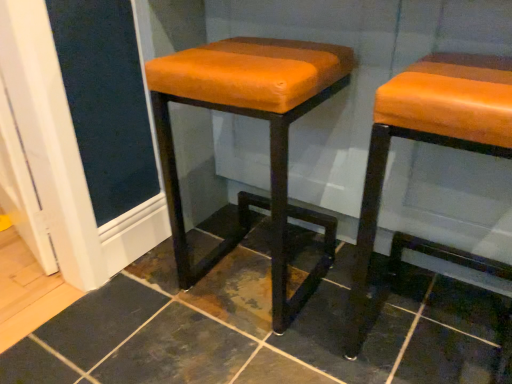
Measure the distance between orange leather stool at center, which appears as the 2th stool when viewed from the right, and camera.

A distance of 30.98 inches exists between orange leather stool at center, which appears as the 2th stool when viewed from the right, and camera.

The width and height of the screenshot is (512, 384). What do you see at coordinates (270, 138) in the screenshot?
I see `orange leather stool at center, which ranks as the first stool in left-to-right order` at bounding box center [270, 138].

Image resolution: width=512 pixels, height=384 pixels. I want to click on orange leather stool at center, which ranks as the first stool in left-to-right order, so click(x=270, y=138).

This screenshot has height=384, width=512. Identify the location of orange leather stool at right, the second stool viewed from the left. (429, 143).

This screenshot has width=512, height=384. Describe the element at coordinates (429, 143) in the screenshot. I see `orange leather stool at right, the second stool viewed from the left` at that location.

Measure the distance between orange leather stool at right, which is the first stool from right to left, and camera.

They are 24.47 inches apart.

At what (x,y) coordinates should I click in order to perform the action: click on orange leather stool at center, which appears as the 2th stool when viewed from the right. Please return your answer as a coordinate pair (x, y). This screenshot has height=384, width=512. Looking at the image, I should click on tap(270, 138).

In the image, is orange leather stool at right, the second stool viewed from the left, on the left side or the right side of orange leather stool at center, which appears as the 2th stool when viewed from the right?

From the image, it's evident that orange leather stool at right, the second stool viewed from the left, is to the right of orange leather stool at center, which appears as the 2th stool when viewed from the right.

In the image, is orange leather stool at right, which is the first stool from right to left, positioned in front of or behind orange leather stool at center, which ranks as the first stool in left-to-right order?

orange leather stool at right, which is the first stool from right to left, is positioned closer to the viewer than orange leather stool at center, which ranks as the first stool in left-to-right order.

Is point (398, 92) positioned after point (289, 40)?

No, it is not.

From the image's perspective, does orange leather stool at right, which is the first stool from right to left, appear lower than orange leather stool at center, which appears as the 2th stool when viewed from the right?

Yes, from the image's perspective, orange leather stool at right, which is the first stool from right to left, is beneath orange leather stool at center, which appears as the 2th stool when viewed from the right.

From a real-world perspective, which object rests below the other?

orange leather stool at center, which appears as the 2th stool when viewed from the right, from a real-world perspective.

In terms of width, does orange leather stool at right, which is the first stool from right to left, look wider or thinner when compared to orange leather stool at center, which ranks as the first stool in left-to-right order?

Considering their sizes, orange leather stool at right, which is the first stool from right to left, looks broader than orange leather stool at center, which ranks as the first stool in left-to-right order.

Which of these two, orange leather stool at right, which is the first stool from right to left, or orange leather stool at center, which ranks as the first stool in left-to-right order, stands taller?

orange leather stool at center, which ranks as the first stool in left-to-right order.

Who is smaller, orange leather stool at right, the second stool viewed from the left, or orange leather stool at center, which appears as the 2th stool when viewed from the right?

Smaller between the two is orange leather stool at right, the second stool viewed from the left.

Would you say orange leather stool at center, which appears as the 2th stool when viewed from the right, is part of orange leather stool at right, which is the first stool from right to left,'s contents?

No, orange leather stool at center, which appears as the 2th stool when viewed from the right, is located outside of orange leather stool at right, which is the first stool from right to left.

Can you see orange leather stool at right, the second stool viewed from the left, touching orange leather stool at center, which ranks as the first stool in left-to-right order?

orange leather stool at right, the second stool viewed from the left, is not next to orange leather stool at center, which ranks as the first stool in left-to-right order, and they're not touching.

Could you tell me if orange leather stool at right, which is the first stool from right to left, is facing orange leather stool at center, which appears as the 2th stool when viewed from the right?

No, orange leather stool at right, which is the first stool from right to left, does not turn towards orange leather stool at center, which appears as the 2th stool when viewed from the right.

How far apart are orange leather stool at right, which is the first stool from right to left, and orange leather stool at center, which appears as the 2th stool when viewed from the right?

They are 11.51 inches apart.

What are the coordinates of `stool located on the right of orange leather stool at center, which appears as the 2th stool when viewed from the right` in the screenshot? It's located at (429, 143).

Between orange leather stool at center, which appears as the 2th stool when viewed from the right, and orange leather stool at right, which is the first stool from right to left, which one appears on the left side from the viewer's perspective?

Positioned to the left is orange leather stool at center, which appears as the 2th stool when viewed from the right.

Relative to orange leather stool at right, which is the first stool from right to left, is orange leather stool at center, which appears as the 2th stool when viewed from the right, in front or behind?

Visually, orange leather stool at center, which appears as the 2th stool when viewed from the right, is located behind orange leather stool at right, which is the first stool from right to left.

Which is in front, point (172, 140) or point (350, 325)?

Point (350, 325)

From the image's perspective, is orange leather stool at center, which appears as the 2th stool when viewed from the right, below orange leather stool at right, which is the first stool from right to left?

No.

From a real-world perspective, is orange leather stool at center, which ranks as the first stool in left-to-right order, under orange leather stool at right, the second stool viewed from the left?

Correct, in the physical world, orange leather stool at center, which ranks as the first stool in left-to-right order, is lower than orange leather stool at right, the second stool viewed from the left.

In terms of width, does orange leather stool at center, which ranks as the first stool in left-to-right order, look wider or thinner when compared to orange leather stool at right, the second stool viewed from the left?

Considering their sizes, orange leather stool at center, which ranks as the first stool in left-to-right order, looks slimmer than orange leather stool at right, the second stool viewed from the left.

Which of these two, orange leather stool at center, which appears as the 2th stool when viewed from the right, or orange leather stool at right, which is the first stool from right to left, stands taller?

With more height is orange leather stool at center, which appears as the 2th stool when viewed from the right.

In the scene shown: Considering the relative sizes of orange leather stool at center, which ranks as the first stool in left-to-right order, and orange leather stool at right, which is the first stool from right to left, in the image provided, is orange leather stool at center, which ranks as the first stool in left-to-right order, bigger than orange leather stool at right, which is the first stool from right to left,?

Yes.

Is orange leather stool at center, which ranks as the first stool in left-to-right order, spatially inside orange leather stool at right, the second stool viewed from the left, or outside of it?

orange leather stool at center, which ranks as the first stool in left-to-right order, is outside orange leather stool at right, the second stool viewed from the left.

Are orange leather stool at center, which ranks as the first stool in left-to-right order, and orange leather stool at right, which is the first stool from right to left, located far from each other?

Actually, orange leather stool at center, which ranks as the first stool in left-to-right order, and orange leather stool at right, which is the first stool from right to left, are a little close together.

Could you tell me if orange leather stool at center, which ranks as the first stool in left-to-right order, is turned towards orange leather stool at right, which is the first stool from right to left?

No, orange leather stool at center, which ranks as the first stool in left-to-right order, is not oriented towards orange leather stool at right, which is the first stool from right to left.

What's the angular difference between orange leather stool at center, which appears as the 2th stool when viewed from the right, and orange leather stool at right, the second stool viewed from the left,'s facing directions?

There is a 2.26-degree angle between the facing directions of orange leather stool at center, which appears as the 2th stool when viewed from the right, and orange leather stool at right, the second stool viewed from the left.

How distant is orange leather stool at center, which ranks as the first stool in left-to-right order, from orange leather stool at right, which is the first stool from right to left?

A distance of 29.23 centimeters exists between orange leather stool at center, which ranks as the first stool in left-to-right order, and orange leather stool at right, which is the first stool from right to left.

Locate an element on the screen. stool located on the right of orange leather stool at center, which ranks as the first stool in left-to-right order is located at coordinates (429, 143).

I want to click on stool behind the orange leather stool at right, the second stool viewed from the left, so coord(270,138).

Where is `stool on the left of orange leather stool at right, which is the first stool from right to left`? The image size is (512, 384). stool on the left of orange leather stool at right, which is the first stool from right to left is located at coordinates (270, 138).